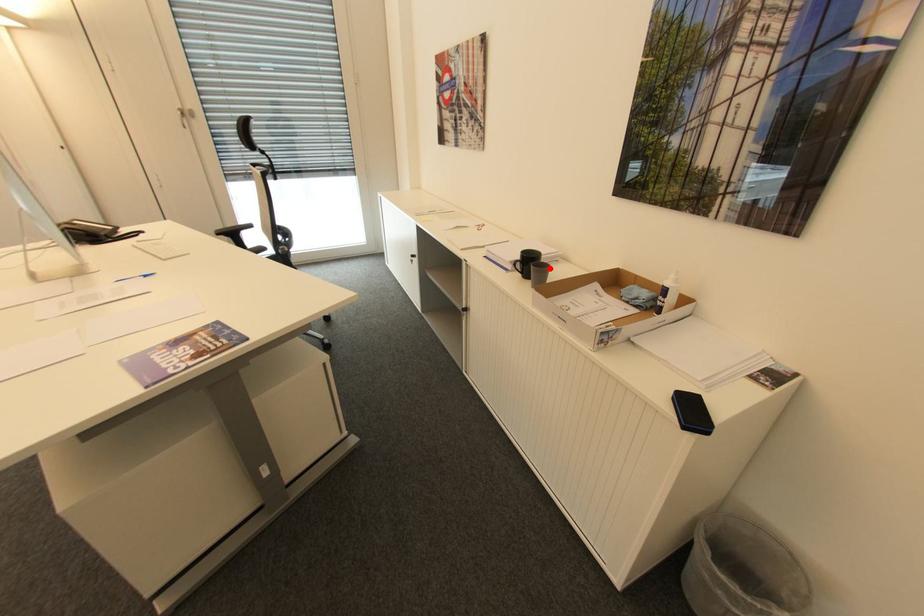
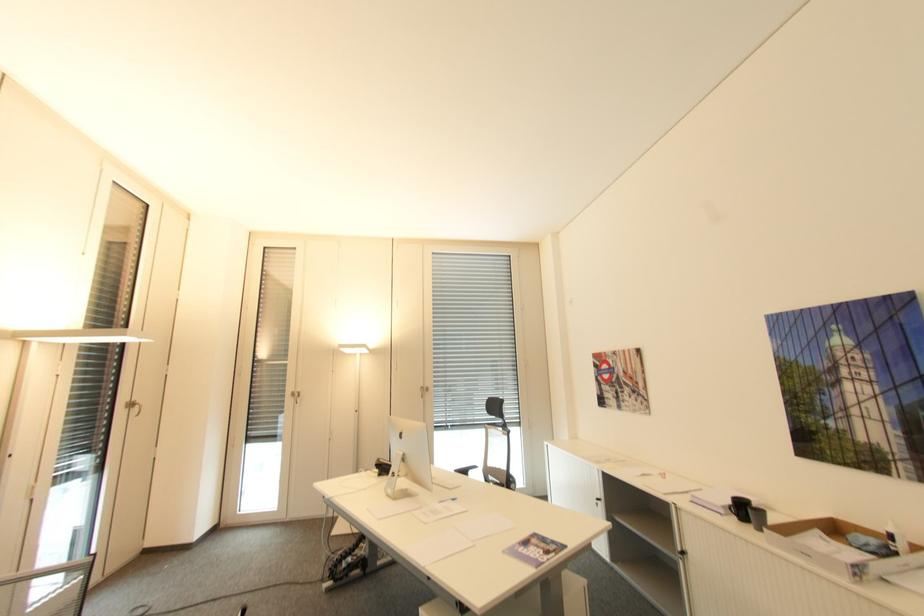
The point at the highlighted location is marked in the first image. Where is the corresponding point in the second image?

(766, 513)